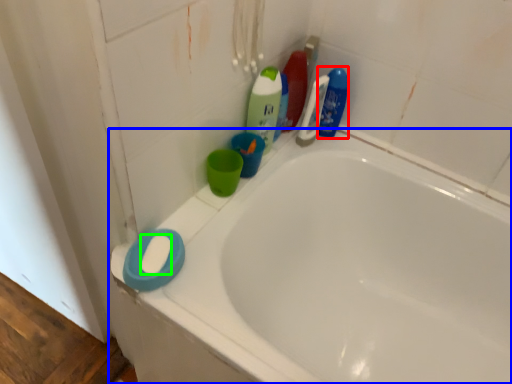
Question: Which object is positioned farthest from cleaning product (highlighted by a red box)? Select from bathtub (highlighted by a blue box) and soap (highlighted by a green box).

Choices:
 (A) bathtub
 (B) soap

Answer: (B)